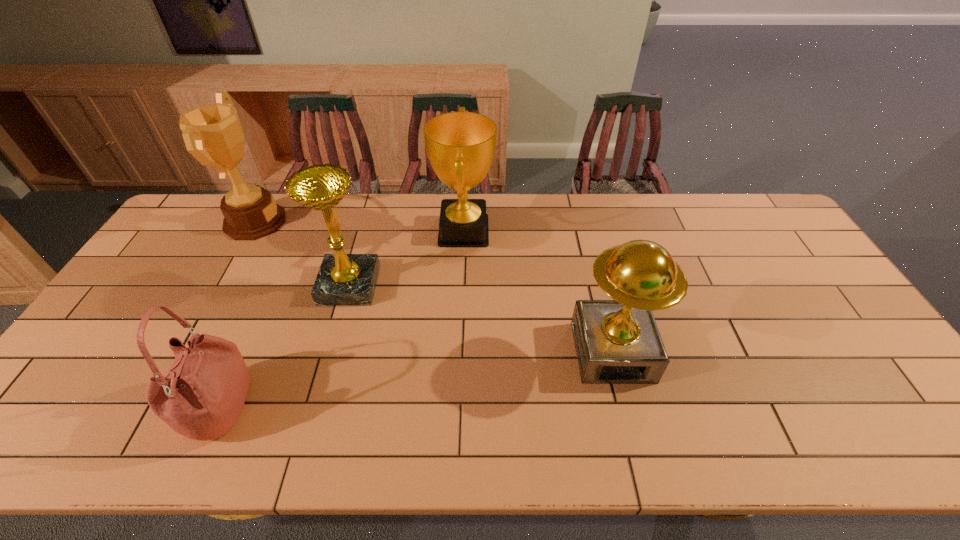
Select which object appears as the fourth closest to the third object from right to left. Please provide its 2D coordinates. Your answer should be formatted as a tuple, i.e. [(x, y)], where the tuple contains the x and y coordinates of a point satisfying the conditions above.

[(617, 341)]

Choose which award is the fourth nearest neighbor to the handbag. Please provide its 2D coordinates. Your answer should be formatted as a tuple, i.e. [(x, y)], where the tuple contains the x and y coordinates of a point satisfying the conditions above.

[(617, 341)]

At what (x,y) coordinates should I click in order to perform the action: click on award object that ranks as the third closest to the leftmost award. Please return your answer as a coordinate pair (x, y). Looking at the image, I should click on (617, 341).

At what (x,y) coordinates should I click in order to perform the action: click on free location that satisfies the following two spatial constraints: 1. on the front-facing side of the handbag; 2. on the left side of the leftmost award. Please return your answer as a coordinate pair (x, y). The width and height of the screenshot is (960, 540). Looking at the image, I should click on (151, 408).

Where is `free location that satisfies the following two spatial constraints: 1. on the back side of the handbag; 2. on the front-facing side of the leftmost award`? The image size is (960, 540). free location that satisfies the following two spatial constraints: 1. on the back side of the handbag; 2. on the front-facing side of the leftmost award is located at coordinates (302, 221).